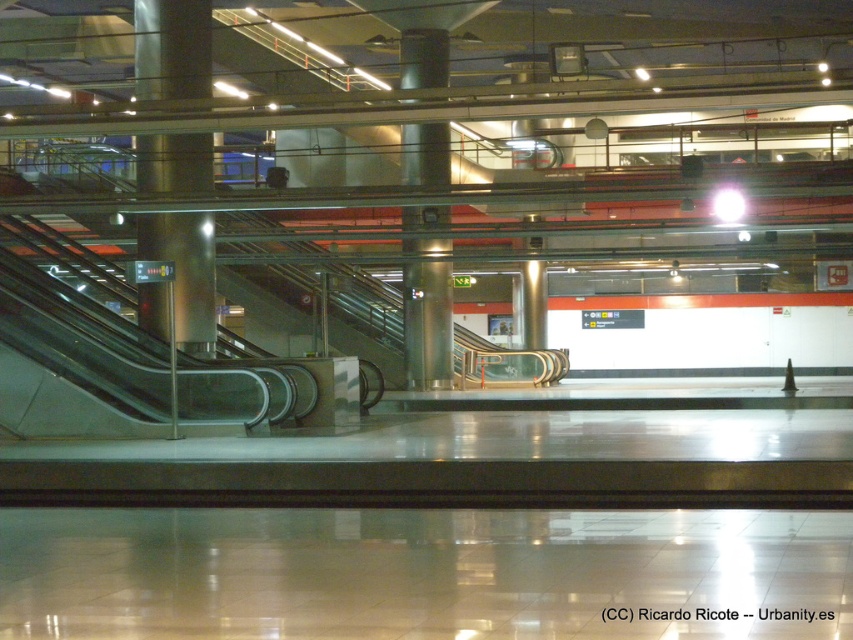
You are standing at the entrance of the subway station and want to locate the satin silver pillar at center. According to the coordinate system where the bottom left corner is the origin, can you determine its exact position?

The satin silver pillar at center is located at coordinate point (172, 49).

You are standing in the modern transportation hub and want to reach the information desk located at point (x=142, y=70). If your walking speed is 1.5 meters per second, how many seconds will it take you to reach the information desk?

The point (x=142, y=70) is 20.18 meters from the viewer. At a walking speed of 1.5 meters per second, it will take approximately 13.45 seconds to reach the information desk.

You are standing in the modern transportation hub and need to reach the information desk located behind the satin silver pillar at center and the satin silver column at center. Which object would you need to go around first to access the desk?

You would need to go around the satin silver pillar at center first because the satin silver column at center is behind it, so the pillar is closer to you and must be navigated first to reach the information desk.